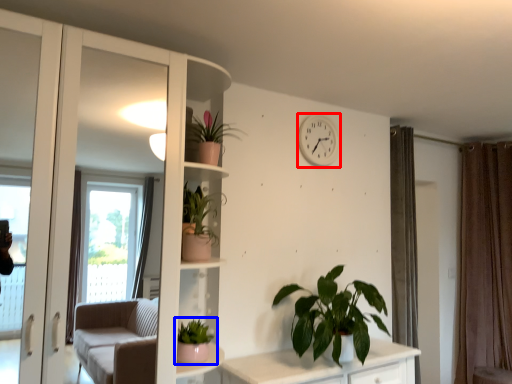
Question: Which object appears farthest to the camera in this image, clock (highlighted by a red box) or houseplant (highlighted by a blue box)?

Choices:
 (A) clock
 (B) houseplant

Answer: (A)